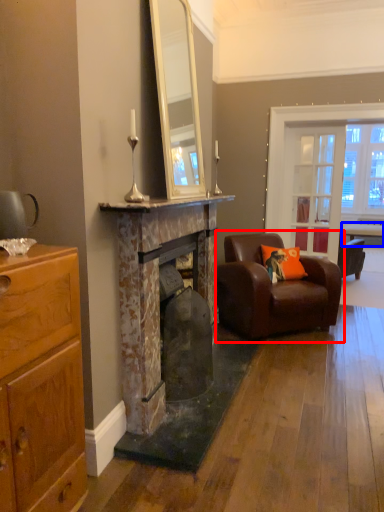
Question: Which object appears closest to the camera in this image, chair (highlighted by a red box) or table (highlighted by a blue box)?

Choices:
 (A) chair
 (B) table

Answer: (A)